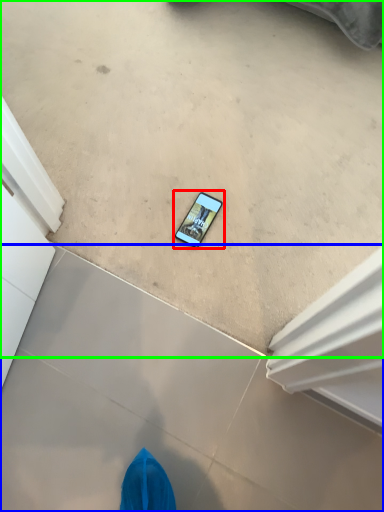
Question: Which is nearer to the mobile phone (highlighted by a red box)? concrete (highlighted by a blue box) or concrete (highlighted by a green box).

Choices:
 (A) concrete
 (B) concrete

Answer: (B)